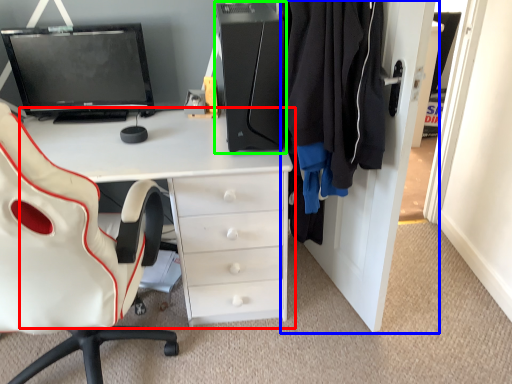
Question: Estimate the real-world distances between objects in this image. Which object is closer to desk (highlighted by a red box), dresser (highlighted by a blue box) or computer tower (highlighted by a green box)?

Choices:
 (A) dresser
 (B) computer tower

Answer: (B)